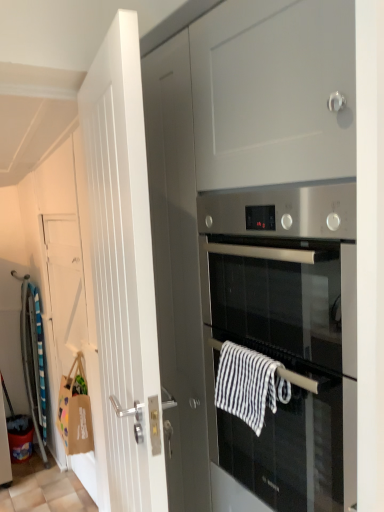
Question: Is striped cotton hand towel at left, positioned as the second hand towel in front-to-back order, oriented away from white wooden door at left, the 1th door viewed from the right?

Choices:
 (A) yes
 (B) no

Answer: (B)

Question: Can we say striped cotton hand towel at left, which appears as the first hand towel when viewed from the left, lies outside white wooden door at left, the 1th door viewed from the right?

Choices:
 (A) yes
 (B) no

Answer: (A)

Question: From the image's perspective, does striped cotton hand towel at left, the first hand towel positioned from the bottom, appear lower than white wooden door at left, the 1th door viewed from the right?

Choices:
 (A) no
 (B) yes

Answer: (B)

Question: Is striped cotton hand towel at left, positioned as the 2th hand towel in top-to-bottom order, smaller than white wooden door at left, acting as the 1th door starting from the front?

Choices:
 (A) yes
 (B) no

Answer: (A)

Question: Does striped cotton hand towel at left, which appears as the first hand towel when viewed from the left, contain white wooden door at left, acting as the 1th door starting from the front?

Choices:
 (A) no
 (B) yes

Answer: (A)

Question: In the image, is striped cotton hand towel at left, which appears as the first hand towel when viewed from the left, on the left side or the right side of stainless steel oven at center?

Choices:
 (A) right
 (B) left

Answer: (B)

Question: In the image, is striped cotton hand towel at left, positioned as the 2th hand towel in top-to-bottom order, positioned in front of or behind stainless steel oven at center?

Choices:
 (A) front
 (B) behind

Answer: (B)

Question: In terms of width, does striped cotton hand towel at left, placed as the 2th hand towel when sorted from right to left, look wider or thinner when compared to stainless steel oven at center?

Choices:
 (A) thin
 (B) wide

Answer: (A)

Question: Considering the positions of striped cotton hand towel at left, positioned as the 2th hand towel in top-to-bottom order, and stainless steel oven at center in the image, is striped cotton hand towel at left, positioned as the 2th hand towel in top-to-bottom order, bigger or smaller than stainless steel oven at center?

Choices:
 (A) big
 (B) small

Answer: (B)

Question: Is point (218, 397) closer or farther from the camera than point (326, 332)?

Choices:
 (A) farther
 (B) closer

Answer: (A)

Question: Is black and white striped towel at center, positioned as the 1th hand towel in right-to-left order, taller or shorter than stainless steel oven at center?

Choices:
 (A) short
 (B) tall

Answer: (A)

Question: In terms of size, does black and white striped towel at center, placed as the 1th hand towel when sorted from front to back, appear bigger or smaller than stainless steel oven at center?

Choices:
 (A) small
 (B) big

Answer: (A)

Question: From the image's perspective, is black and white striped towel at center, which is counted as the 2th hand towel, starting from the back, positioned above or below stainless steel oven at center?

Choices:
 (A) above
 (B) below

Answer: (B)

Question: Considering their positions, is white wooden door at left, the second door viewed from the back, located in front of or behind brown paper bag at left, arranged as the second door when viewed from the right?

Choices:
 (A) behind
 (B) front

Answer: (B)

Question: Is white wooden door at left, the second door viewed from the back, inside or outside of brown paper bag at left, which appears as the second door when viewed from the front?

Choices:
 (A) outside
 (B) inside

Answer: (A)